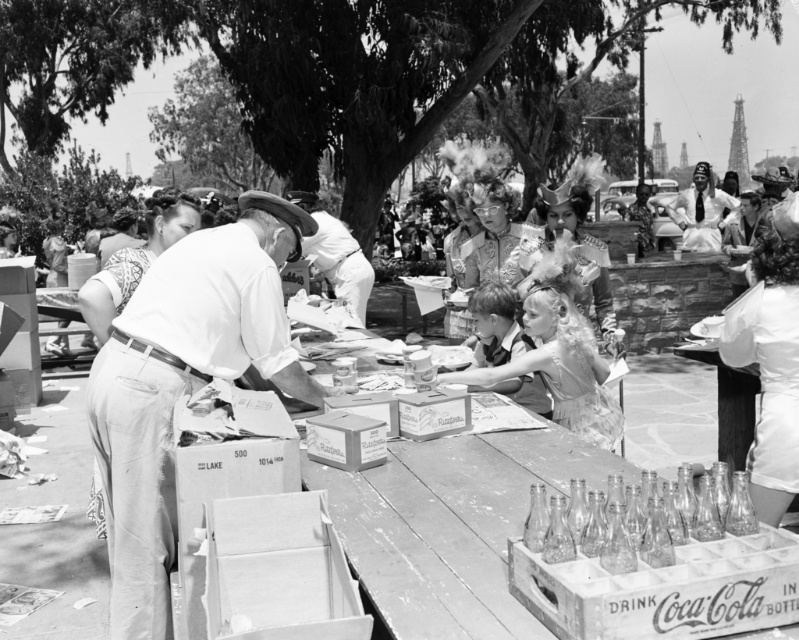
Is smooth white shirt at center below matte cardboard box at center?

Incorrect, smooth white shirt at center is not positioned below matte cardboard box at center.

Looking at this image, does smooth white shirt at center have a larger size compared to matte cardboard box at center?

Correct, smooth white shirt at center is larger in size than matte cardboard box at center.

Identify the location of smooth white shirt at center. (336, 256).

Based on the photo, who is shorter, cardboard box at center or transparent glass bottles at lower center?

transparent glass bottles at lower center

Is point (205, 513) closer to viewer compared to point (609, 524)?

That is False.

You are a GUI agent. You are given a task and a screenshot of the screen. Output one action in this format:
    pyautogui.click(x=<x>, y=<y>)
    Task: Click on the cardboard box at center
    
    Given the screenshot: What is the action you would take?
    pyautogui.click(x=277, y=572)

Can you confirm if clear glass bottles at lower right is positioned to the left of cardboard box at center?

In fact, clear glass bottles at lower right is to the right of cardboard box at center.

Is the position of clear glass bottles at lower right less distant than that of cardboard box at center?

Yes, clear glass bottles at lower right is closer to the viewer.

You are a GUI agent. You are given a task and a screenshot of the screen. Output one action in this format:
    pyautogui.click(x=<x>, y=<y>)
    Task: Click on the clear glass bottles at lower right
    The image size is (799, 640).
    Given the screenshot: What is the action you would take?
    pyautogui.click(x=664, y=589)